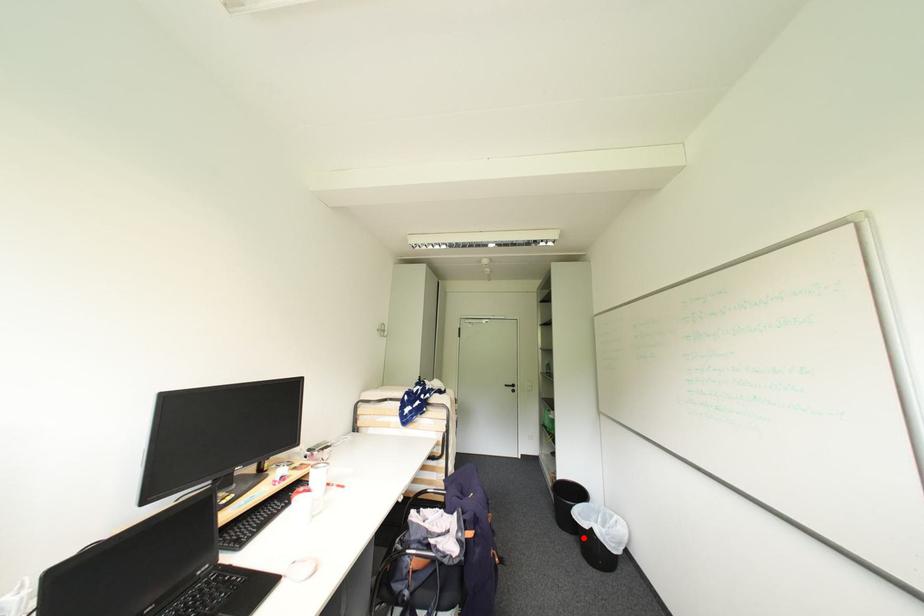
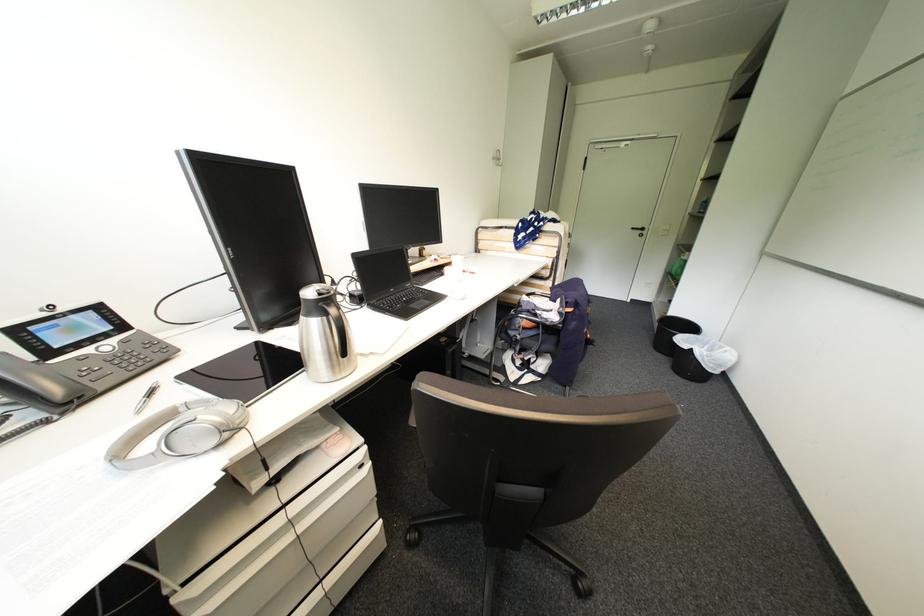
The point at the highlighted location is marked in the first image. Where is the corresponding point in the second image?

(677, 359)